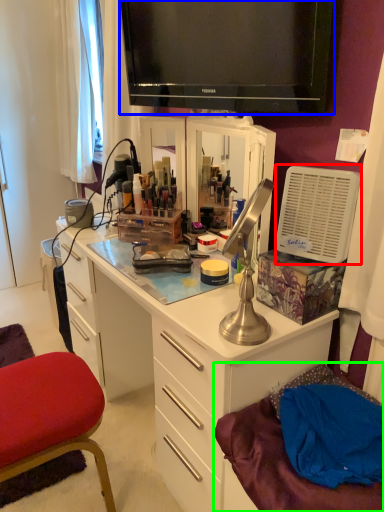
Question: Based on their relative distances, which object is farther from appliance (highlighted by a red box)? Choose from television (highlighted by a blue box) and wide (highlighted by a green box).

Choices:
 (A) television
 (B) wide

Answer: (B)